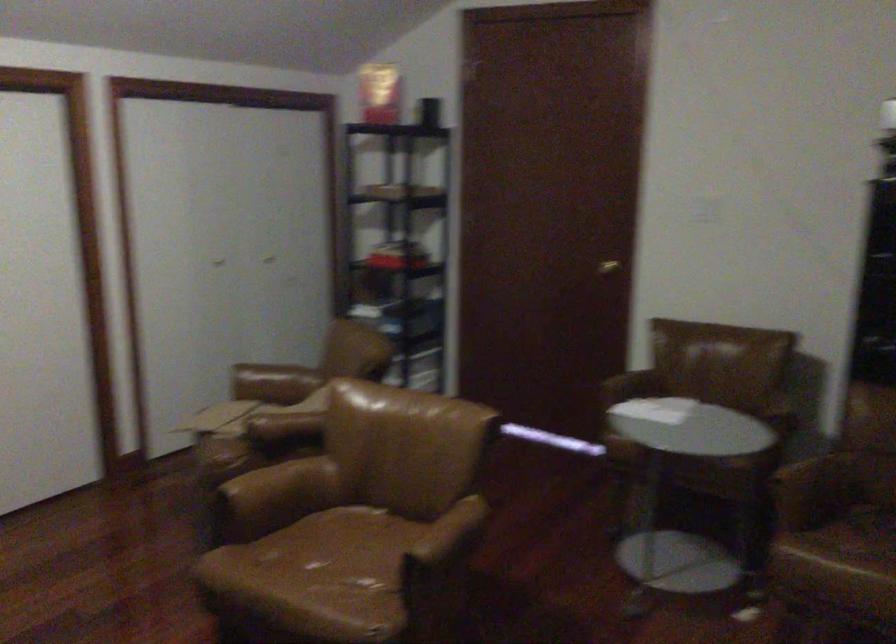
Identify the location of brown chair sitting surface. Image resolution: width=896 pixels, height=644 pixels. click(343, 556).